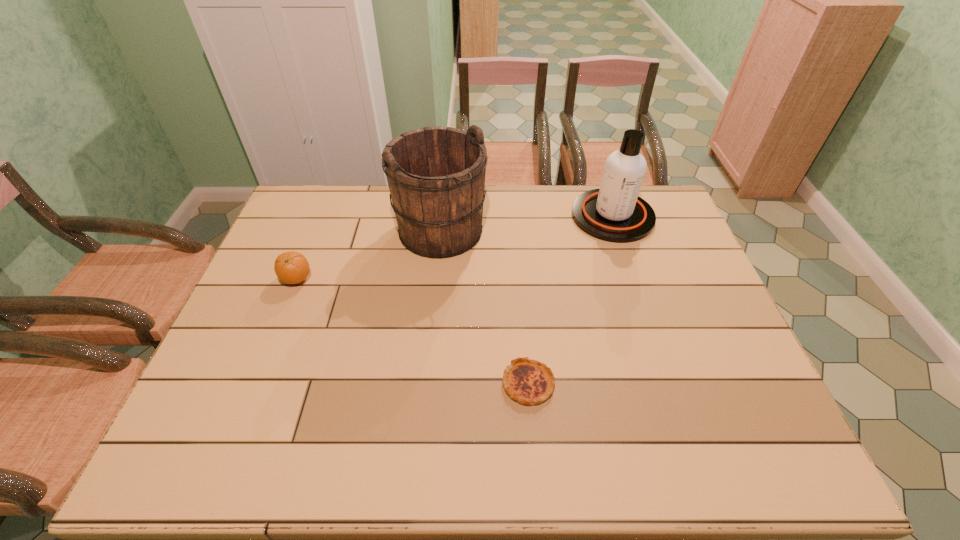
This screenshot has width=960, height=540. Find the location of `bucket`. bucket is located at coordinates (436, 175).

Find the location of a particular element. The width and height of the screenshot is (960, 540). cleansing agent is located at coordinates (615, 213).

Find the location of a particular element. Image resolution: width=960 pixels, height=540 pixels. the leftmost object is located at coordinates (291, 267).

Where is `orange`? This screenshot has height=540, width=960. orange is located at coordinates (291, 267).

I want to click on the shortest object, so click(x=529, y=382).

I want to click on quiche, so click(x=529, y=382).

Where is `vacant area situated 0.350m on the right of the bucket`? The height and width of the screenshot is (540, 960). vacant area situated 0.350m on the right of the bucket is located at coordinates (591, 231).

Where is `free spot located 0.170m on the left of the rightmost object`? Image resolution: width=960 pixels, height=540 pixels. free spot located 0.170m on the left of the rightmost object is located at coordinates (523, 216).

I want to click on vacant space positioned 0.400m on the front of the orange, so click(241, 419).

Locate an element on the screen. This screenshot has width=960, height=540. vacant region located 0.220m on the left of the shortest object is located at coordinates click(x=413, y=383).